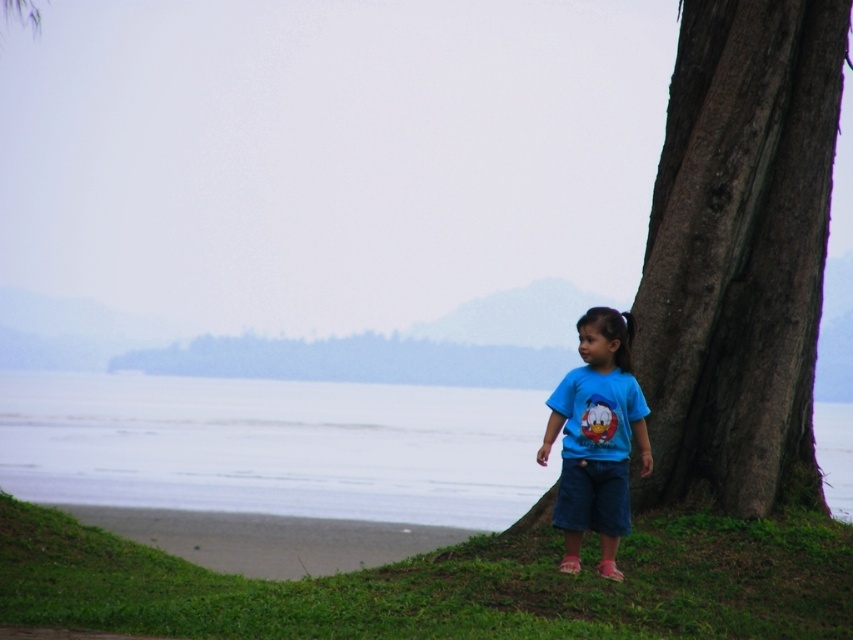
Question: Observing the image, what is the correct spatial positioning of smooth water at lower center in reference to blue cotton shirt at lower right?

Choices:
 (A) left
 (B) right

Answer: (B)

Question: Is dark brown textured bark at right thinner than sandy shore at lower left?

Choices:
 (A) yes
 (B) no

Answer: (A)

Question: Is dark brown textured bark at right bigger than blue cotton shirt at lower right?

Choices:
 (A) no
 (B) yes

Answer: (B)

Question: Among these points, which one is farthest from the camera?

Choices:
 (A) (x=589, y=524)
 (B) (x=656, y=269)
 (C) (x=224, y=428)
 (D) (x=271, y=538)

Answer: (C)

Question: Which object appears closest to the camera in this image?

Choices:
 (A) sandy shore at lower left
 (B) smooth water at lower center
 (C) dark brown textured bark at right
 (D) blue cotton shirt at lower right

Answer: (D)

Question: Which point is closer to the camera taking this photo?

Choices:
 (A) (567, 529)
 (B) (207, 540)

Answer: (A)